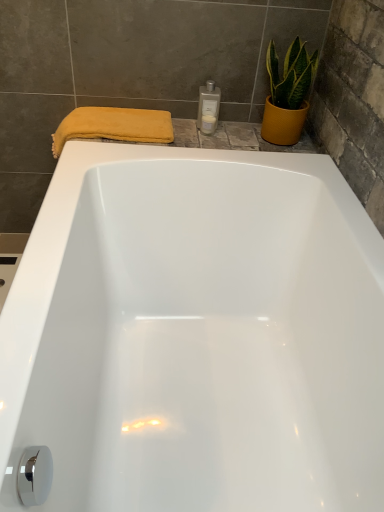
The image size is (384, 512). I want to click on unoccupied area in front of white glossy bottle at upper center, the second toiletry positioned from the top, so click(x=202, y=142).